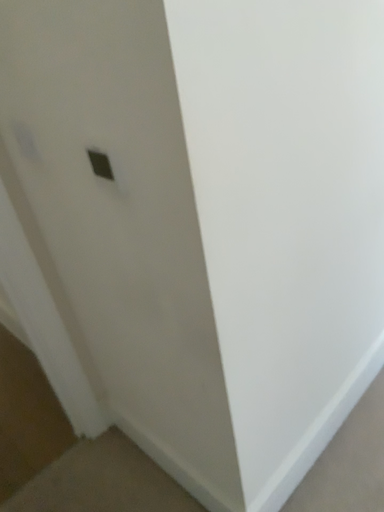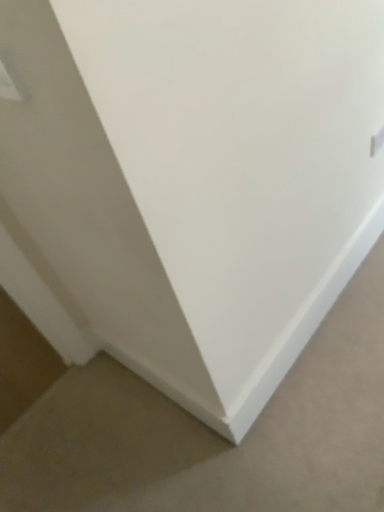
Question: How did the camera likely rotate when shooting the video?

Choices:
 (A) rotated upward
 (B) rotated downward

Answer: (B)